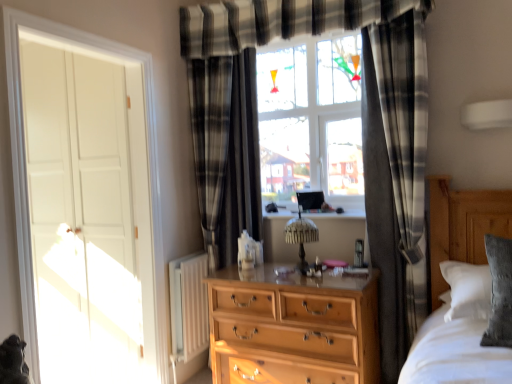
I want to click on vacant space situated above white matte door at left (from a real-world perspective), so pos(79,41).